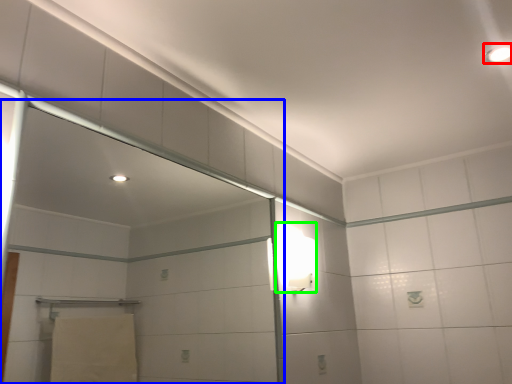
Question: Based on their relative distances, which object is farther from light fixture (highlighted by a red box)? Choose from screen door (highlighted by a blue box) and light fixture (highlighted by a green box).

Choices:
 (A) screen door
 (B) light fixture

Answer: (A)